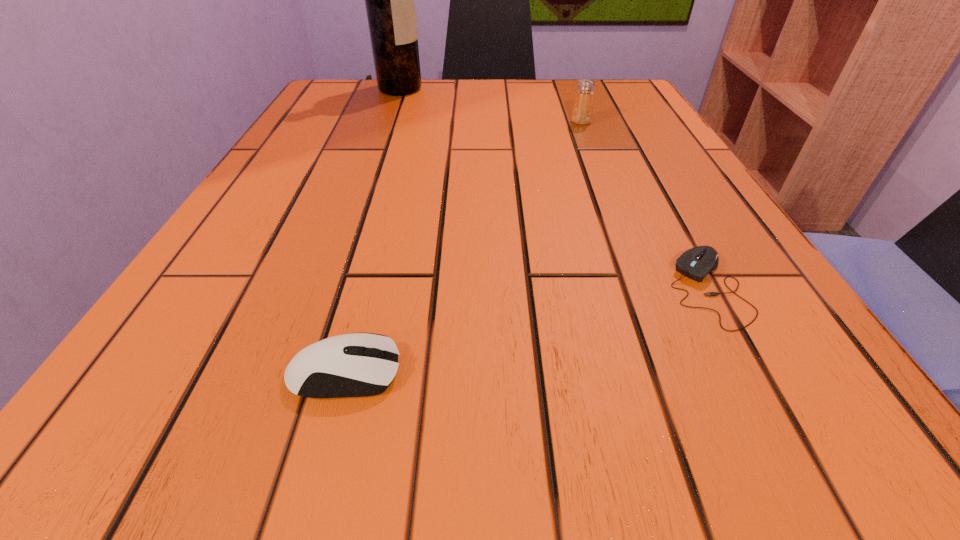
Image resolution: width=960 pixels, height=540 pixels. I want to click on free space at the far edge of the desktop, so click(x=530, y=100).

This screenshot has height=540, width=960. Find the location of `free space at the near edge of the desktop`. free space at the near edge of the desktop is located at coordinates (386, 410).

What are the coordinates of `vacant space at the left edge of the desktop` in the screenshot? It's located at (314, 223).

Identify the location of vacant region at the right edge of the desktop. Image resolution: width=960 pixels, height=540 pixels. (653, 170).

Where is `vacant position at the far left corner of the desktop`? vacant position at the far left corner of the desktop is located at coordinates (354, 84).

Locate an element on the screen. vacant space at the near left corner of the desktop is located at coordinates (179, 407).

The width and height of the screenshot is (960, 540). In order to click on free region at the near right corner in this screenshot , I will do `click(803, 386)`.

Locate an element on the screen. free space between the liquor and the left computer mouse is located at coordinates (372, 231).

Identify the location of free space that is in between the taller computer mouse and the farthest object. (372, 231).

Where is `free space between the second tallest object and the tallest object`? This screenshot has width=960, height=540. free space between the second tallest object and the tallest object is located at coordinates (491, 105).